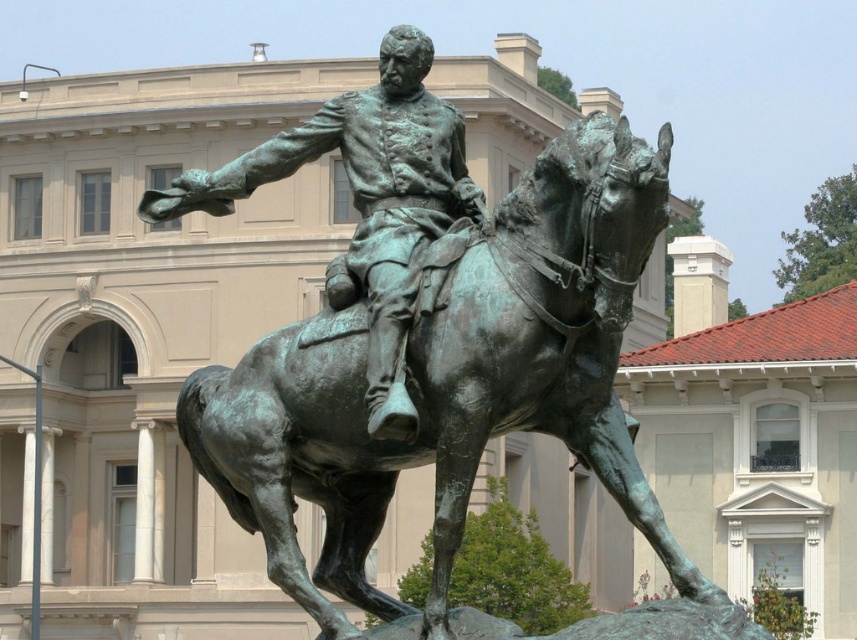
You are an art conservator assessing the bronze equestrian statue. You notice that the green patina horse at center and the green patina statue at center are both covered in a protective layer. Which part of the statue has a wider surface area requiring more material for conservation?

The green patina horse at center has a larger width than the green patina statue at center, so the horse requires more material for conservation due to its greater surface area.

You are standing in front of a bronze equestrian statue. The statue features a rider on a horse. The rider is wearing a military uniform and the horse has a green patina. Based on the coordinates provided, where exactly is the green patina horse at center located in the image?

The green patina horse at center is located at point coordinates of (451, 381).